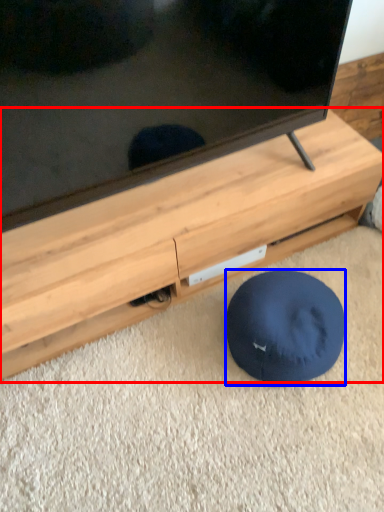
Question: Which point is closer to the camera, furniture (highlighted by a red box) or dog bed (highlighted by a blue box)?

Choices:
 (A) furniture
 (B) dog bed

Answer: (A)